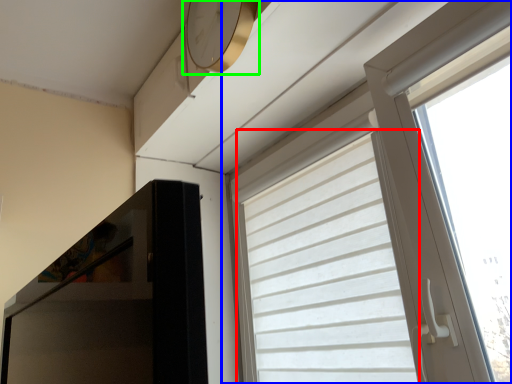
Question: Considering the real-world distances, which object is closest to curtain (highlighted by a red box)? window (highlighted by a blue box) or clock (highlighted by a green box).

Choices:
 (A) window
 (B) clock

Answer: (A)